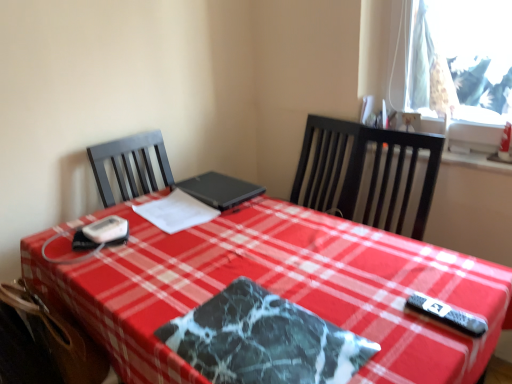
Question: Is marble-patterned placemat at center further to camera compared to white paper at center?

Choices:
 (A) yes
 (B) no

Answer: (B)

Question: Is white paper at center surrounded by marble-patterned placemat at center?

Choices:
 (A) no
 (B) yes

Answer: (A)

Question: Is marble-patterned placemat at center placed right next to white paper at center?

Choices:
 (A) yes
 (B) no

Answer: (B)

Question: Is the depth of marble-patterned placemat at center less than that of white paper at center?

Choices:
 (A) yes
 (B) no

Answer: (A)

Question: Does marble-patterned placemat at center have a lesser height compared to white paper at center?

Choices:
 (A) yes
 (B) no

Answer: (A)

Question: Is marble-patterned placemat at center bigger than white paper at center?

Choices:
 (A) no
 (B) yes

Answer: (B)

Question: Is the depth of brown leather swivel chair at lower left less than that of white paper at center?

Choices:
 (A) yes
 (B) no

Answer: (A)

Question: From a real-world perspective, is brown leather swivel chair at lower left on white paper at center?

Choices:
 (A) no
 (B) yes

Answer: (A)

Question: Considering the relative positions of brown leather swivel chair at lower left and white paper at center in the image provided, is brown leather swivel chair at lower left to the left of white paper at center from the viewer's perspective?

Choices:
 (A) yes
 (B) no

Answer: (A)

Question: Does brown leather swivel chair at lower left come behind white paper at center?

Choices:
 (A) yes
 (B) no

Answer: (B)

Question: From a real-world perspective, is brown leather swivel chair at lower left under white paper at center?

Choices:
 (A) no
 (B) yes

Answer: (B)

Question: Does brown leather swivel chair at lower left appear on the right side of white paper at center?

Choices:
 (A) yes
 (B) no

Answer: (B)

Question: Is black matte laptop at center outside of white paper at center?

Choices:
 (A) yes
 (B) no

Answer: (A)